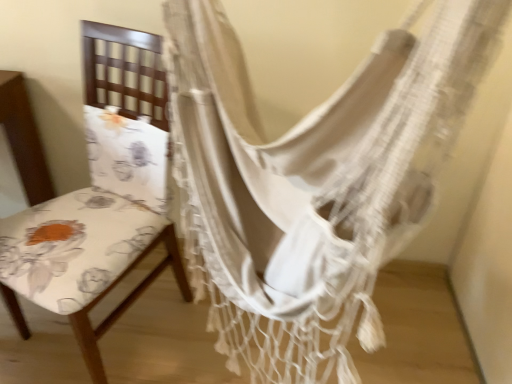
Locate an element on the screen. vacant space in floral fabric chair at left (from a real-world perspective) is located at coordinates (115, 328).